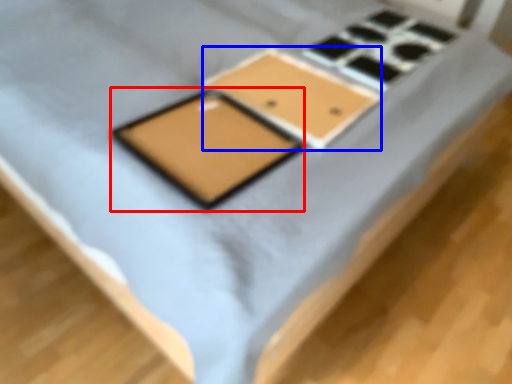
Question: Which object appears closest to the camera in this image, tablet computer (highlighted by a red box) or rectangle (highlighted by a blue box)?

Choices:
 (A) tablet computer
 (B) rectangle

Answer: (A)